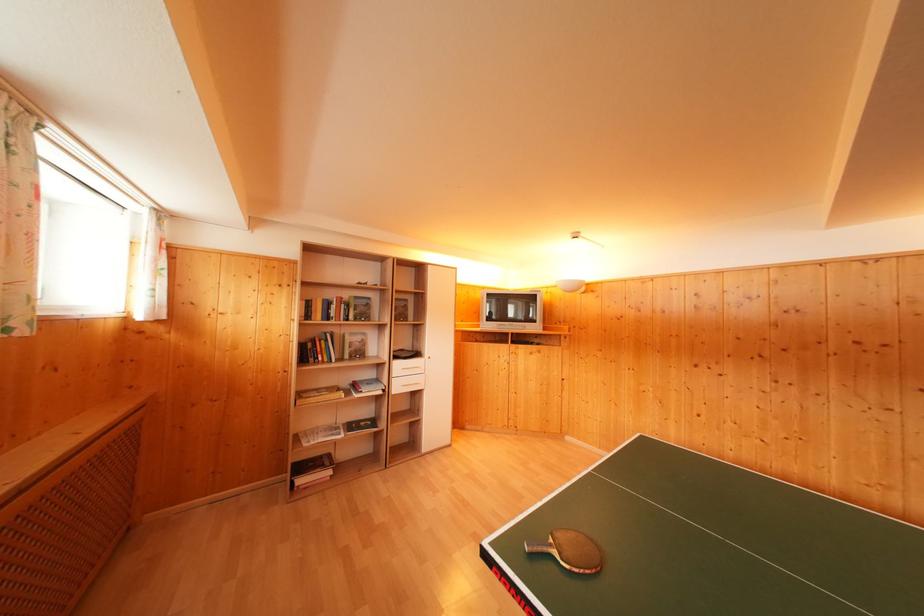
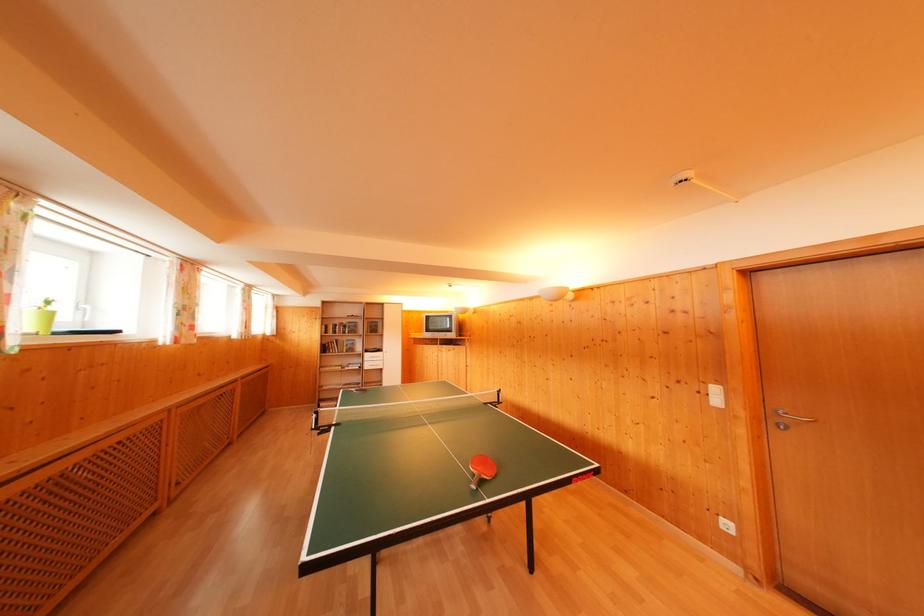
The point at (x=402, y=370) is marked in the first image. Where is the corresponding point in the second image?

(371, 360)